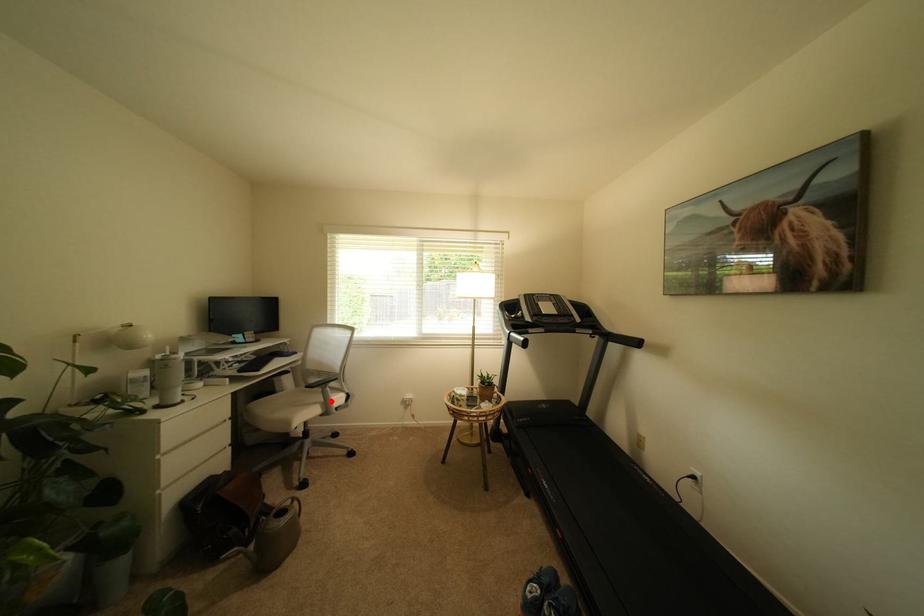
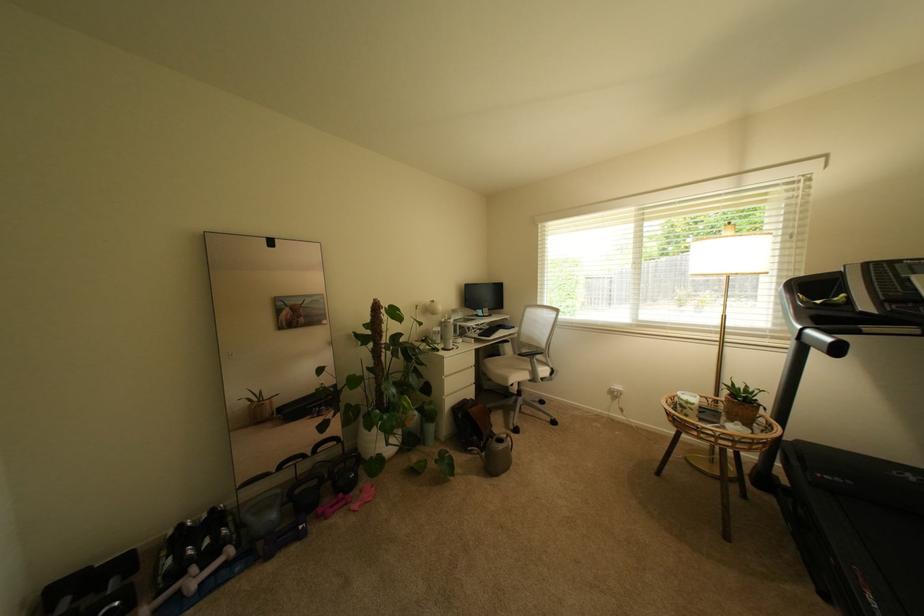
Find the pixel in the second image that matches the highlighted location in the first image.

(540, 370)